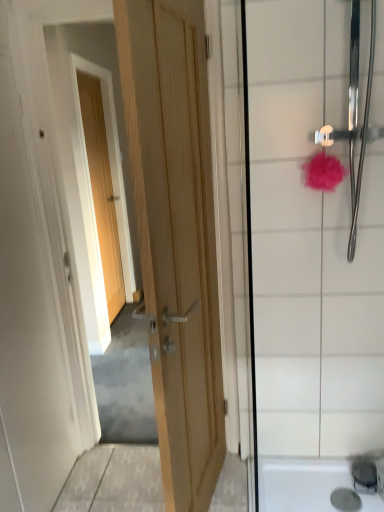
Where is `pink fluffy sponge at upper right`? pink fluffy sponge at upper right is located at coordinates (355, 117).

At what (x,y) coordinates should I click in order to perform the action: click on white glossy shower door at right. Please return your answer as a coordinate pair (x, y). Looking at the image, I should click on (310, 262).

What are the coordinates of `pink fluffy bath puff at upper right` in the screenshot? It's located at (323, 172).

Is pink fluffy sponge at upper right to the left or to the right of white glossy shower door at right in the image?

From the image, it's evident that pink fluffy sponge at upper right is to the right of white glossy shower door at right.

Is pink fluffy sponge at upper right in front of or behind white glossy shower door at right in the image?

Visually, pink fluffy sponge at upper right is located in front of white glossy shower door at right.

In the scene shown: From the image's perspective, which is below, pink fluffy sponge at upper right or white glossy shower door at right?

white glossy shower door at right is shown below in the image.

Locate an element on the screen. The width and height of the screenshot is (384, 512). shower on the right of white glossy shower door at right is located at coordinates (355, 117).

Is pink fluffy bath puff at upper right positioned before pink fluffy sponge at upper right?

No, pink fluffy bath puff at upper right is further to the viewer.

Can you tell me how much pink fluffy bath puff at upper right and pink fluffy sponge at upper right differ in facing direction?

There is a 0.102-degree angle between the facing directions of pink fluffy bath puff at upper right and pink fluffy sponge at upper right.

Measure the distance from pink fluffy bath puff at upper right to pink fluffy sponge at upper right.

pink fluffy bath puff at upper right is 16.00 centimeters from pink fluffy sponge at upper right.

Which is closer to the camera, (312, 164) or (380, 131)?

The point (312, 164) is more forward.

Between satin nickel faucet at lower right and light wood door at upper left, which is counted as the second door, starting from the right, which one has less height?

satin nickel faucet at lower right.

From a real-world perspective, is satin nickel faucet at lower right located beneath light wood door at upper left, which is counted as the second door, starting from the right?

Yes, from a real-world perspective, satin nickel faucet at lower right is under light wood door at upper left, which is counted as the second door, starting from the right.

Between satin nickel faucet at lower right and light wood door at upper left, arranged as the 1th door when viewed from the left, which one appears on the right side from the viewer's perspective?

satin nickel faucet at lower right is more to the right.

Is the surface of satin nickel faucet at lower right in direct contact with light wood door at upper left, arranged as the 1th door when viewed from the left?

No, satin nickel faucet at lower right is not in contact with light wood door at upper left, arranged as the 1th door when viewed from the left.

Is white glossy shower door at right far away from satin nickel faucet at lower right?

They are positioned close to each other.

Between white glossy shower door at right and satin nickel faucet at lower right, which one has more height?

white glossy shower door at right is taller.

From the image's perspective, which is above, white glossy shower door at right or satin nickel faucet at lower right?

white glossy shower door at right is shown above in the image.

Consider the image. Could you tell me if white glossy shower door at right is turned towards satin nickel faucet at lower right?

Yes, white glossy shower door at right is facing satin nickel faucet at lower right.

Looking at this image, in terms of width, does light wood door at upper left, which is counted as the second door, starting from the right, look wider or thinner when compared to pink fluffy bath puff at upper right?

Clearly, light wood door at upper left, which is counted as the second door, starting from the right, has less width compared to pink fluffy bath puff at upper right.

Considering the sizes of objects light wood door at upper left, placed as the 2th door when sorted from front to back, and pink fluffy bath puff at upper right in the image provided, who is bigger, light wood door at upper left, placed as the 2th door when sorted from front to back, or pink fluffy bath puff at upper right?

Bigger between the two is light wood door at upper left, placed as the 2th door when sorted from front to back.

Can you confirm if light wood door at upper left, arranged as the 1th door when viewed from the left, is positioned to the left of pink fluffy bath puff at upper right?

Correct, you'll find light wood door at upper left, arranged as the 1th door when viewed from the left, to the left of pink fluffy bath puff at upper right.

Considering the sizes of objects light wood door at upper left, which is counted as the first door, starting from the back, and pink fluffy bath puff at upper right in the image provided, who is shorter, light wood door at upper left, which is counted as the first door, starting from the back, or pink fluffy bath puff at upper right?

pink fluffy bath puff at upper right is shorter.

Which point is more forward, (307, 184) or (289, 85)?

Point (289, 85)

Find the location of a particular element. The width and height of the screenshot is (384, 512). shower door on the right side of pink fluffy bath puff at upper right is located at coordinates (310, 262).

Can you confirm if pink fluffy bath puff at upper right is positioned to the left of white glossy shower door at right?

Indeed, pink fluffy bath puff at upper right is positioned on the left side of white glossy shower door at right.

How different are the orientations of pink fluffy bath puff at upper right and white glossy shower door at right in degrees?

0.705 degrees.

Which point is more distant from viewer, (325,165) or (360,487)?

The point (360,487) is farther.

Between pink fluffy bath puff at upper right and satin nickel faucet at lower right, which one has larger size?

pink fluffy bath puff at upper right.

Is satin nickel faucet at lower right at the back of pink fluffy bath puff at upper right?

That's not correct — pink fluffy bath puff at upper right is not looking away from satin nickel faucet at lower right.

Is pink fluffy bath puff at upper right further to camera compared to satin nickel faucet at lower right?

No, it is in front of satin nickel faucet at lower right.

In the image, there is a pink fluffy sponge at upper right. Where is `shower door below it (from the image's perspective)`? The height and width of the screenshot is (512, 384). shower door below it (from the image's perspective) is located at coordinates (310, 262).

Image resolution: width=384 pixels, height=512 pixels. I want to click on shower located above the pink fluffy bath puff at upper right (from a real-world perspective), so click(355, 117).

Estimate the real-world distances between objects in this image. Which object is closer to satin nickel faucet at lower right, pink fluffy sponge at upper right or wooden door at center, which ranks as the 2th door in left-to-right order?

wooden door at center, which ranks as the 2th door in left-to-right order, lies closer to satin nickel faucet at lower right than the other object.

Looking at the image, which one is located closer to pink fluffy bath puff at upper right, pink fluffy sponge at upper right or satin nickel faucet at lower right?

Based on the image, pink fluffy sponge at upper right appears to be nearer to pink fluffy bath puff at upper right.

Which object lies further to the anchor point light wood door at upper left, which is counted as the second door, starting from the right, pink fluffy sponge at upper right or wooden door at center, arranged as the 1th door when viewed from the right?

pink fluffy sponge at upper right lies further to light wood door at upper left, which is counted as the second door, starting from the right, than the other object.

Considering their positions, is wooden door at center, which ranks as the 2th door in left-to-right order, positioned further to pink fluffy sponge at upper right than satin nickel faucet at lower right?

satin nickel faucet at lower right is positioned further to the anchor pink fluffy sponge at upper right.

When comparing their distances from pink fluffy bath puff at upper right, does light wood door at upper left, which is counted as the first door, starting from the back, or pink fluffy sponge at upper right seem further?

light wood door at upper left, which is counted as the first door, starting from the back, is positioned further to the anchor pink fluffy bath puff at upper right.

Which object lies further to the anchor point wooden door at center, arranged as the 1th door when viewed from the right, pink fluffy bath puff at upper right or pink fluffy sponge at upper right?

The object further to wooden door at center, arranged as the 1th door when viewed from the right, is pink fluffy bath puff at upper right.

When comparing their distances from wooden door at center, arranged as the first door when viewed from the front, does white glossy shower door at right or light wood door at upper left, which is counted as the second door, starting from the right, seem closer?

white glossy shower door at right is closer to wooden door at center, arranged as the first door when viewed from the front.

When comparing their distances from satin nickel faucet at lower right, does white glossy shower door at right or wooden door at center, arranged as the first door when viewed from the front, seem closer?

Among the two, white glossy shower door at right is located nearer to satin nickel faucet at lower right.

In order to click on shower door positioned between wooden door at center, the 2th door from the back, and pink fluffy bath puff at upper right from near to far in this screenshot , I will do `click(310, 262)`.

This screenshot has height=512, width=384. I want to click on door between pink fluffy bath puff at upper right and satin nickel faucet at lower right vertically, so click(x=176, y=234).

Locate an element on the screen. Image resolution: width=384 pixels, height=512 pixels. shower door between wooden door at center, arranged as the 1th door when viewed from the right, and pink fluffy sponge at upper right from left to right is located at coordinates (310, 262).

Image resolution: width=384 pixels, height=512 pixels. Find the location of `shower door between pink fluffy bath puff at upper right and satin nickel faucet at lower right vertically`. shower door between pink fluffy bath puff at upper right and satin nickel faucet at lower right vertically is located at coordinates (310, 262).